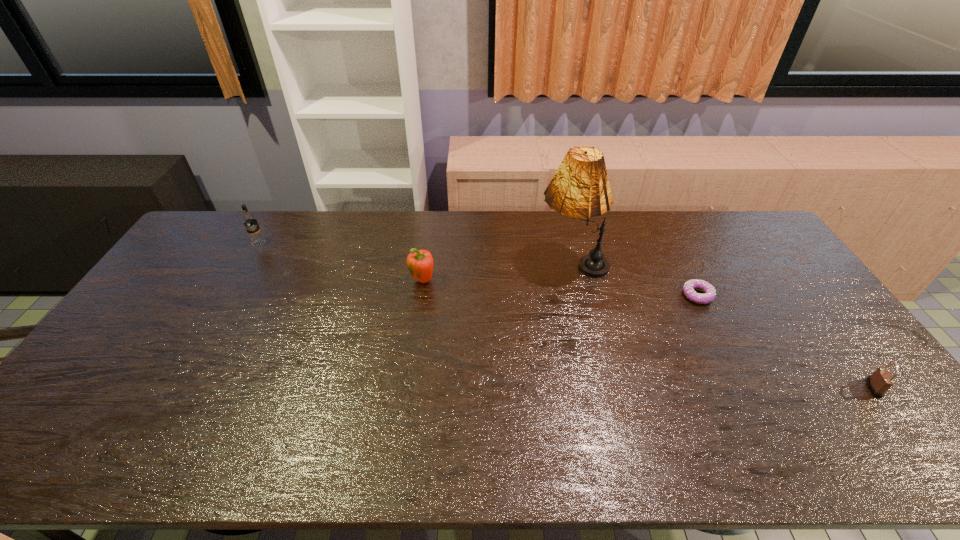
I want to click on vacant region that satisfies the following two spatial constraints: 1. on the front side of the second object from right to left; 2. on the right side of the third tallest object, so click(420, 295).

In order to click on blank space that satisfies the following two spatial constraints: 1. on the label of the fourth object from right to left; 2. on the left side of the vodka in this screenshot , I will do `click(237, 281)`.

This screenshot has height=540, width=960. Find the location of `vacant space that satisfies the following two spatial constraints: 1. on the front-facing side of the lampshade; 2. on the right side of the fourth tallest object`. vacant space that satisfies the following two spatial constraints: 1. on the front-facing side of the lampshade; 2. on the right side of the fourth tallest object is located at coordinates (601, 388).

This screenshot has width=960, height=540. I want to click on blank space that satisfies the following two spatial constraints: 1. on the back side of the second shortest object; 2. on the front-facing side of the third object from right to left, so 780,263.